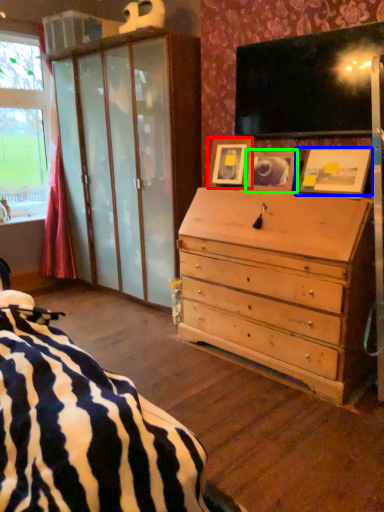
Question: Which is nearer to the picture frame (highlighted by a red box)? picture frame (highlighted by a blue box) or picture frame (highlighted by a green box).

Choices:
 (A) picture frame
 (B) picture frame

Answer: (B)